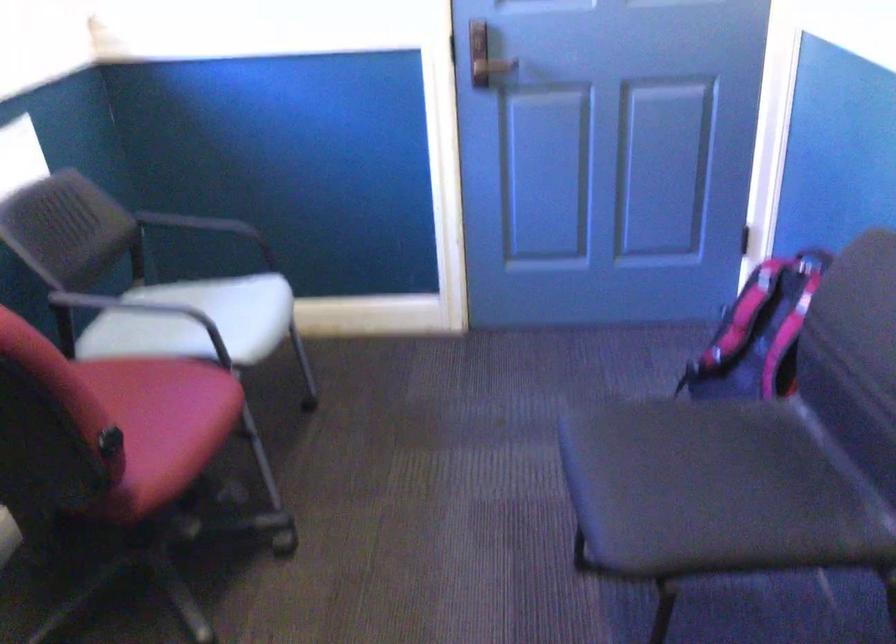
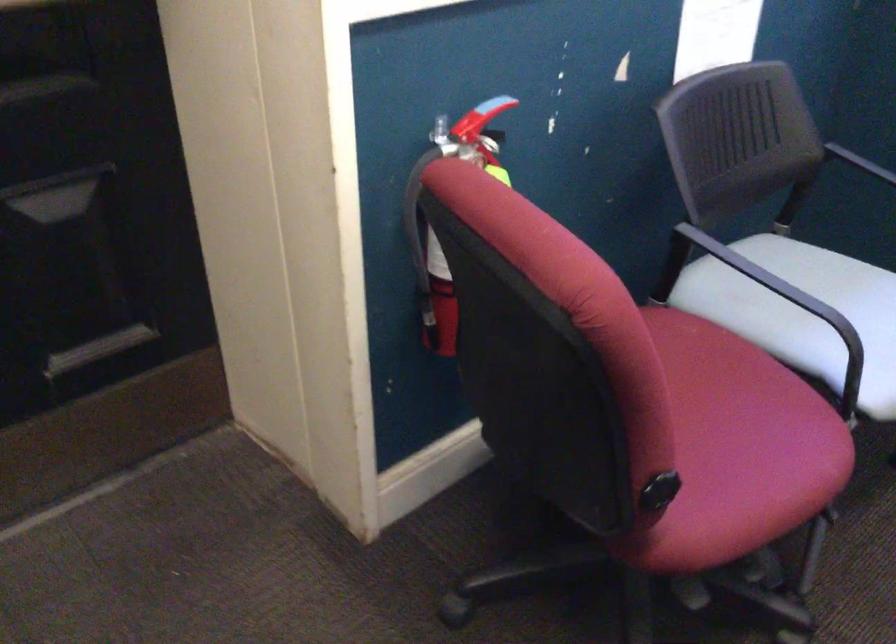
In the second image, find the point that corresponds to the point at 135,375 in the first image.

(714, 366)